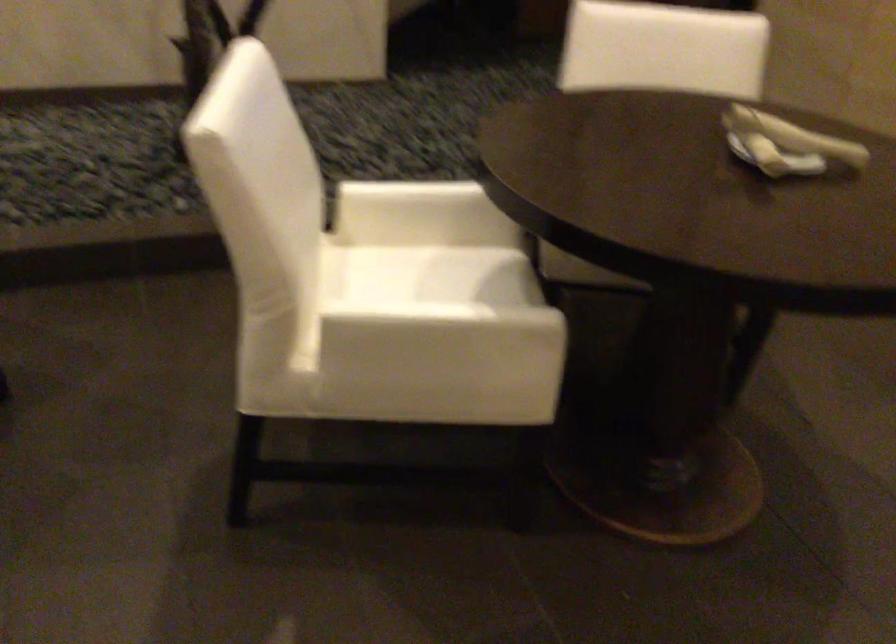
Where is `chair sitting surface`? The height and width of the screenshot is (644, 896). chair sitting surface is located at coordinates (412, 261).